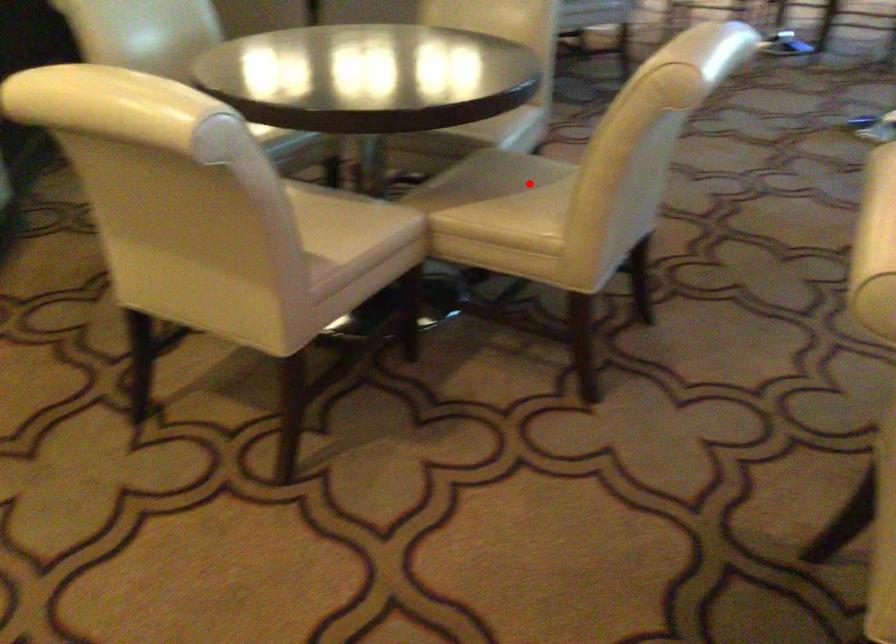
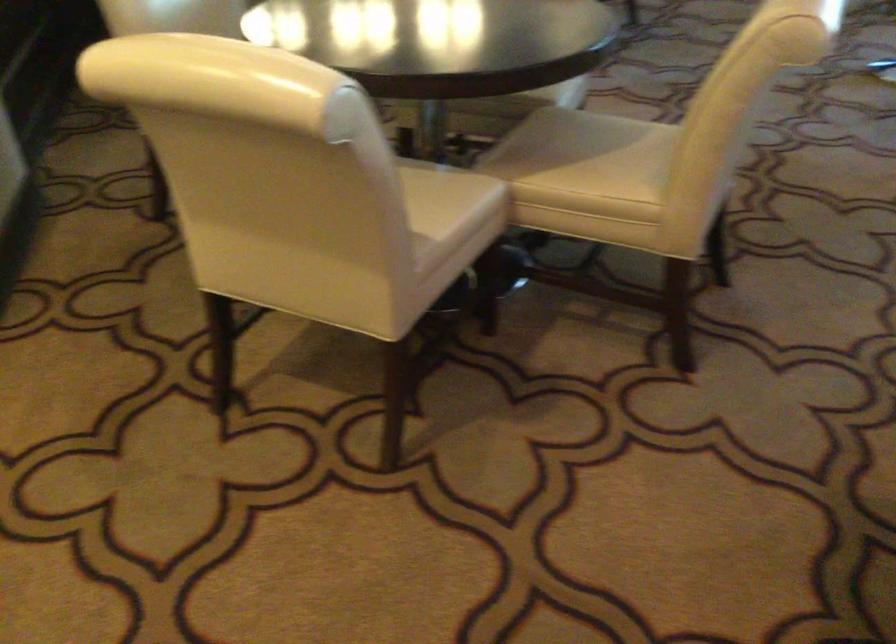
Find the pixel in the second image that matches the highlighted location in the first image.

(613, 144)